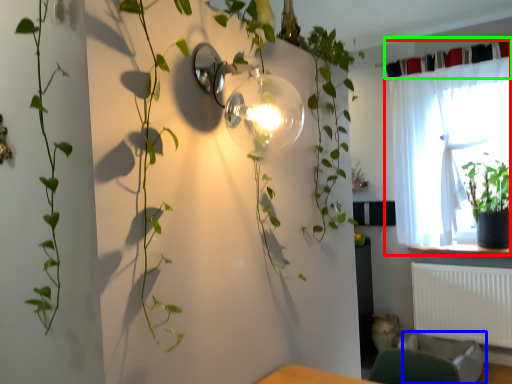
Question: Which is farther away from curtain (highlighted by a red box)? swivel chair (highlighted by a blue box) or curtain (highlighted by a green box)?

Choices:
 (A) swivel chair
 (B) curtain

Answer: (A)